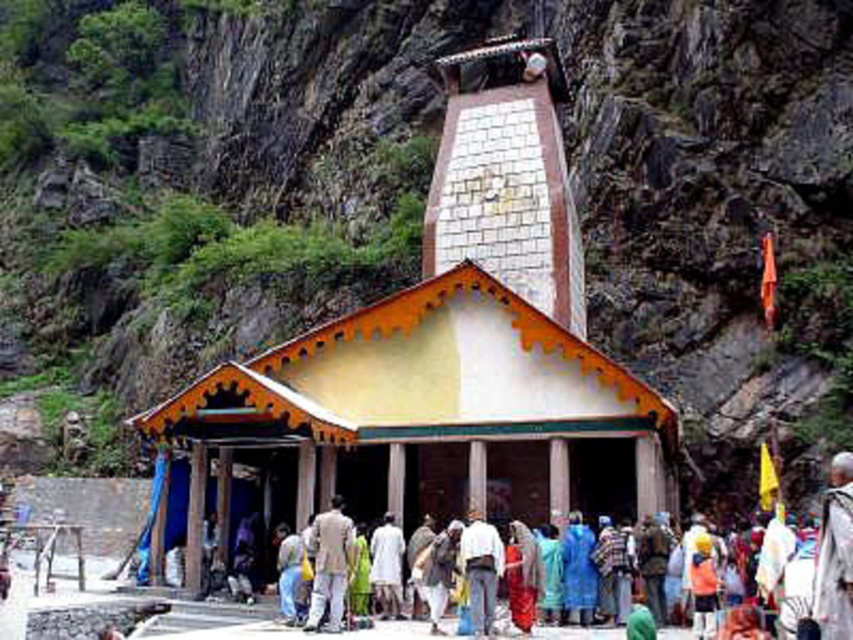
Question: Based on their relative distances, which object is farther from the light brown fabric jacket at center?

Choices:
 (A) white stone temple at center
 (B) white fabric at center

Answer: (B)

Question: Which of the following is the closest to the observer?

Choices:
 (A) (376, 342)
 (B) (834, 515)

Answer: (B)

Question: Does white stone temple at center have a lesser width compared to white fabric at center?

Choices:
 (A) yes
 (B) no

Answer: (B)

Question: Where is white stone temple at center located in relation to white fabric at center in the image?

Choices:
 (A) above
 (B) below

Answer: (A)

Question: Can you confirm if white fabric at center is positioned to the right of light brown fabric jacket at center?

Choices:
 (A) no
 (B) yes

Answer: (B)

Question: Which point is closer to the camera?

Choices:
 (A) white stone temple at center
 (B) white fabric at center

Answer: (B)